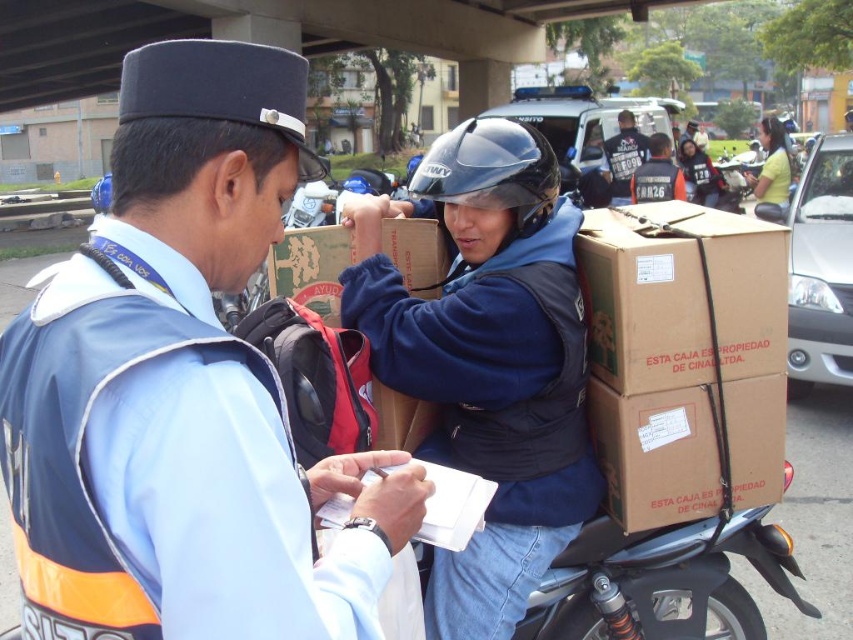
Question: Can you confirm if black matte helmet at center is positioned above yellow matte shirt at upper right?

Choices:
 (A) no
 (B) yes

Answer: (A)

Question: Which point is farther from the camera taking this photo?

Choices:
 (A) (474, 161)
 (B) (349, 244)
 (C) (758, 196)
 (D) (392, 307)

Answer: (C)

Question: Considering the relative positions of black matte helmet at center and dark blue shirt at center in the image provided, where is black matte helmet at center located with respect to dark blue shirt at center?

Choices:
 (A) left
 (B) right

Answer: (A)

Question: Which of the following is the farthest from the observer?

Choices:
 (A) (631, 195)
 (B) (180, 440)

Answer: (A)

Question: Among these points, which one is farthest from the camera?

Choices:
 (A) (94, 560)
 (B) (515, 212)
 (C) (331, 266)
 (D) (622, 134)

Answer: (D)

Question: Is blue uniform at center wider than matte black helmet at upper center?

Choices:
 (A) no
 (B) yes

Answer: (B)